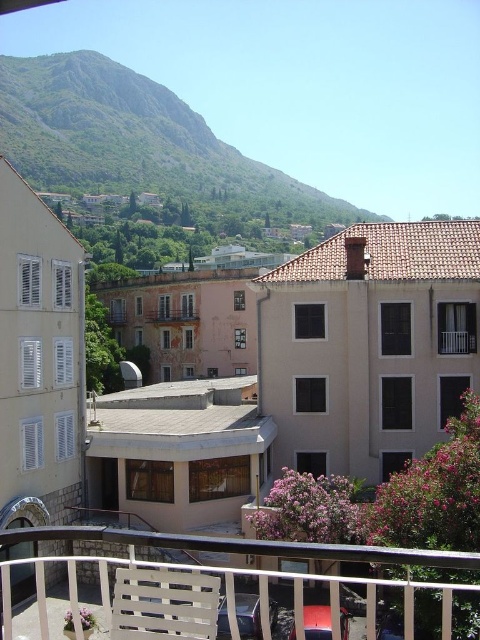
You are standing on the balcony and want to sit down. Which object, the white plastic chair at lower center or the brown wooden balcony at center, is nearer to you?

The white plastic chair at lower center is closer to you than the brown wooden balcony at center.